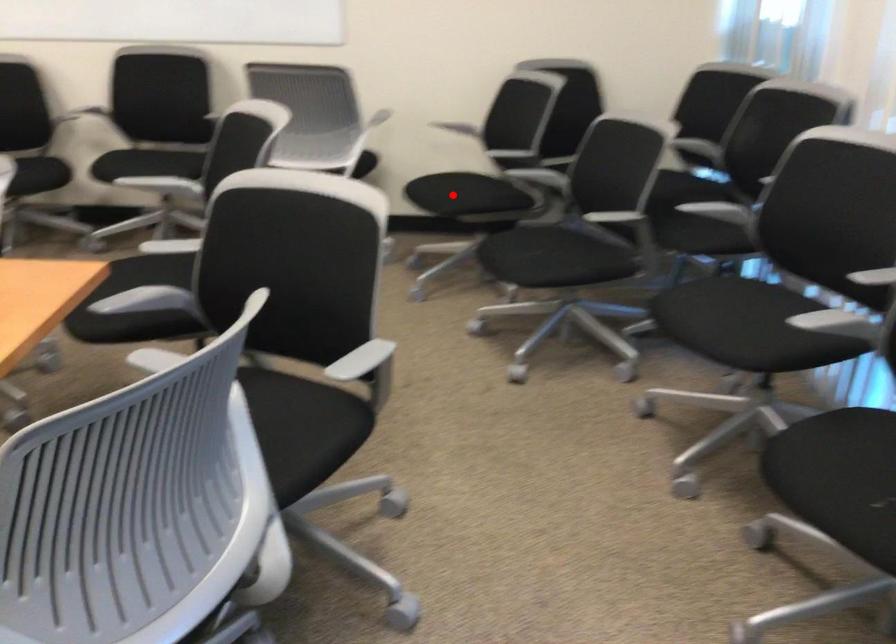
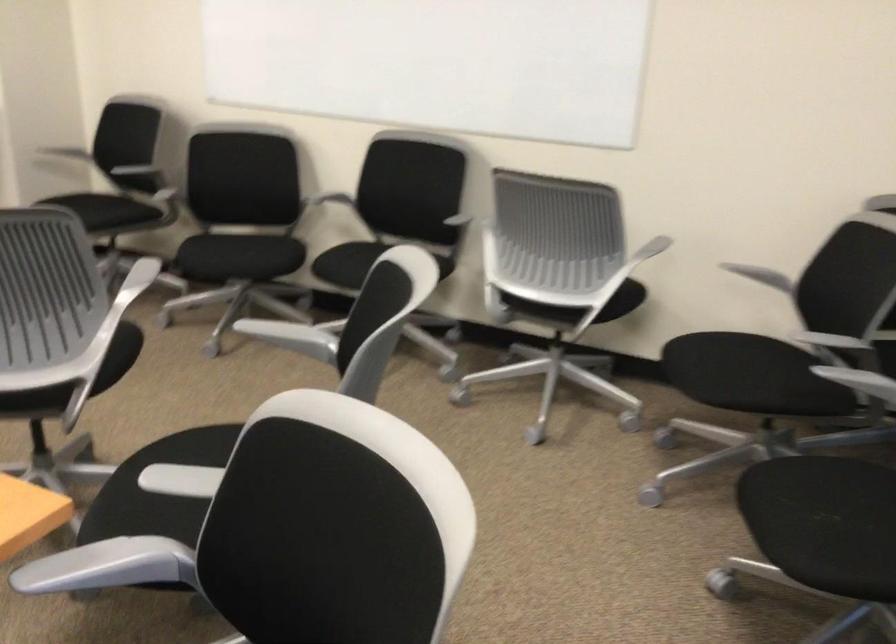
In the second image, find the point that corresponds to the highlighted location in the first image.

(721, 377)